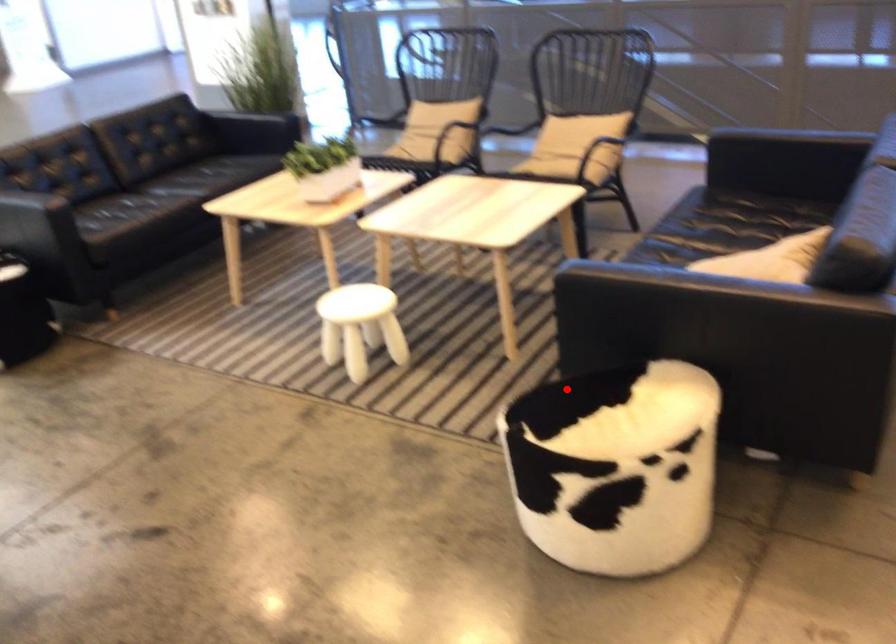
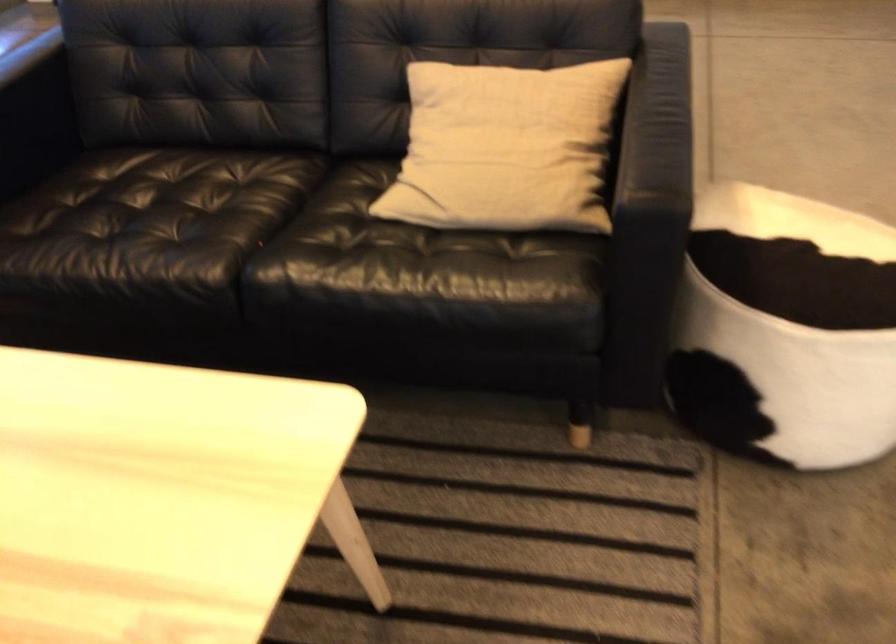
Locate, in the second image, the point that corresponds to the highlighted location in the first image.

(786, 330)